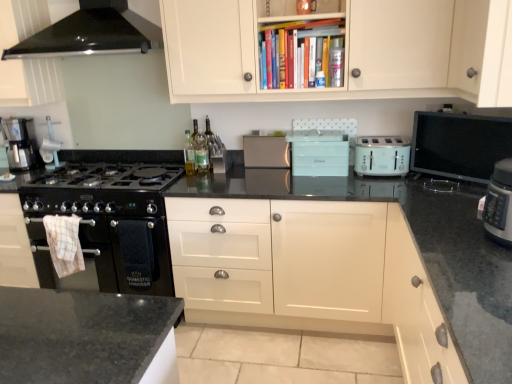
Question: In which direction should I rotate to look at translucent plastic bottle at upper center, positioned as the third bottle in bottom-to-top order?

Choices:
 (A) left
 (B) right

Answer: (B)

Question: Which direction should I rotate to look at white matte cabinet at upper center, arranged as the first cabinetry when viewed from the top?

Choices:
 (A) left
 (B) right

Answer: (A)

Question: Is mint green plastic toaster at center, which is the second appliance in right-to-left order, at the back of translucent glass bottle at center, the second bottle in the front-to-back sequence?

Choices:
 (A) yes
 (B) no

Answer: (B)

Question: Can you confirm if translucent glass bottle at center, acting as the second bottle starting from the back, is thinner than mint green plastic toaster at center, which is the second appliance in right-to-left order?

Choices:
 (A) no
 (B) yes

Answer: (B)

Question: Is translucent glass bottle at center, marked as the 3th bottle in a top-to-bottom arrangement, next to mint green plastic toaster at center, which is the second appliance in right-to-left order?

Choices:
 (A) no
 (B) yes

Answer: (A)

Question: Can you confirm if translucent glass bottle at center, which is the 1th bottle in left-to-right order, is wider than mint green plastic toaster at center, which is the second appliance in right-to-left order?

Choices:
 (A) no
 (B) yes

Answer: (A)

Question: From a real-world perspective, does translucent glass bottle at center, the second bottle in the front-to-back sequence, sit lower than mint green plastic toaster at center, placed as the second appliance when sorted from left to right?

Choices:
 (A) no
 (B) yes

Answer: (A)

Question: Does translucent glass bottle at center, acting as the second bottle starting from the back, have a smaller size compared to mint green plastic toaster at center, which is the second appliance in right-to-left order?

Choices:
 (A) yes
 (B) no

Answer: (A)

Question: Is mint green plastic toaster at center, placed as the second appliance when sorted from left to right, placed right next to white matte cabinet at upper center, which appears as the 4th cabinetry when ordered from the bottom?

Choices:
 (A) no
 (B) yes

Answer: (A)

Question: Is mint green plastic toaster at center, which is the second appliance in right-to-left order, aimed at white matte cabinet at upper center, which appears as the 4th cabinetry when ordered from the bottom?

Choices:
 (A) no
 (B) yes

Answer: (A)

Question: Is mint green plastic toaster at center, placed as the second appliance when sorted from left to right, far from white matte cabinet at upper center, arranged as the first cabinetry when viewed from the top?

Choices:
 (A) no
 (B) yes

Answer: (A)

Question: Is mint green plastic toaster at center, which is the second appliance in right-to-left order, to the right of white matte cabinet at upper center, which appears as the 4th cabinetry when ordered from the bottom, from the viewer's perspective?

Choices:
 (A) yes
 (B) no

Answer: (A)

Question: Considering the relative sizes of mint green plastic toaster at center, which is the second appliance in right-to-left order, and white matte cabinet at upper center, arranged as the first cabinetry when viewed from the top, in the image provided, is mint green plastic toaster at center, which is the second appliance in right-to-left order, shorter than white matte cabinet at upper center, arranged as the first cabinetry when viewed from the top,?

Choices:
 (A) no
 (B) yes

Answer: (B)

Question: From the image's perspective, does mint green plastic toaster at center, placed as the second appliance when sorted from left to right, appear higher than white matte cabinet at upper center, arranged as the first cabinetry when viewed from the top?

Choices:
 (A) yes
 (B) no

Answer: (B)

Question: Is metallic silver coffee machine at left located outside green glass bottle at center?

Choices:
 (A) yes
 (B) no

Answer: (A)